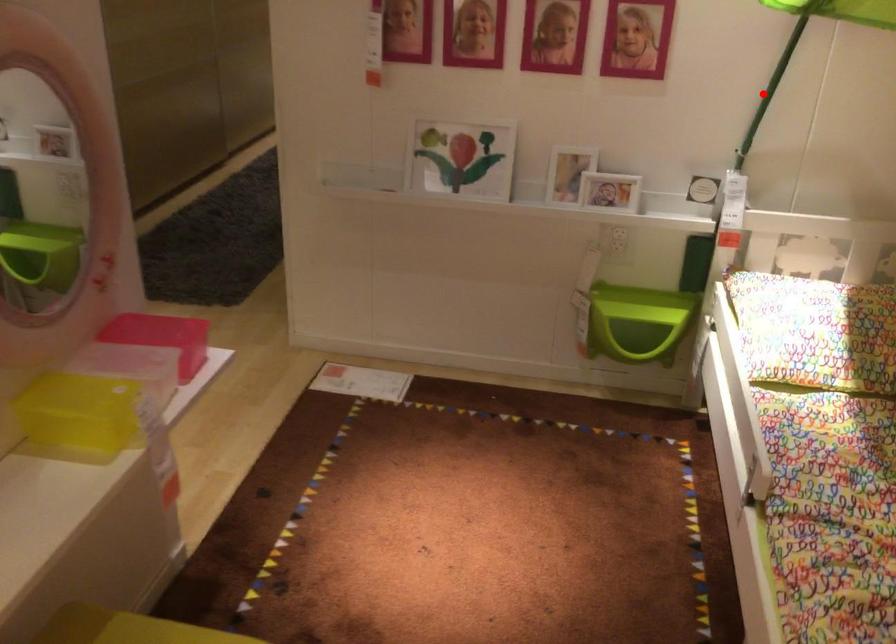
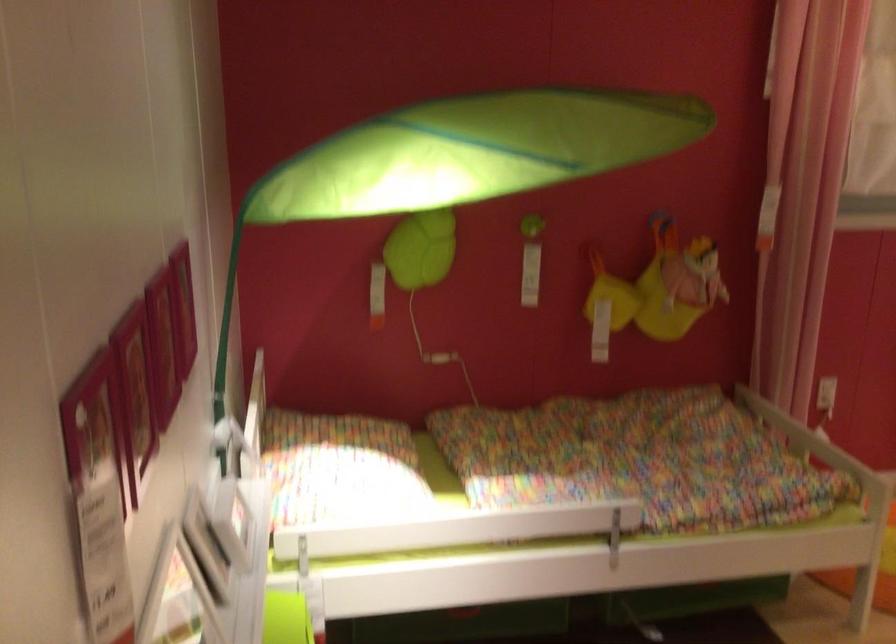
Question: I am providing you with two images of the same scene from different viewpoints. Image1 has a red point marked. In image2, the corresponding 3D location appears at what relative position? Reply with the corresponding letter.

Choices:
 (A) Closer
 (B) Farther

Answer: (A)